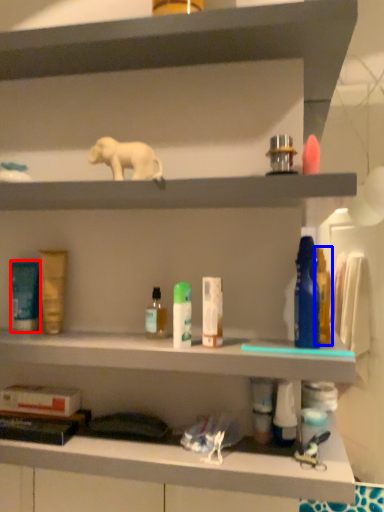
Question: Among these objects, which one is farthest to the camera, toiletry (highlighted by a red box) or toiletry (highlighted by a blue box)?

Choices:
 (A) toiletry
 (B) toiletry

Answer: (A)